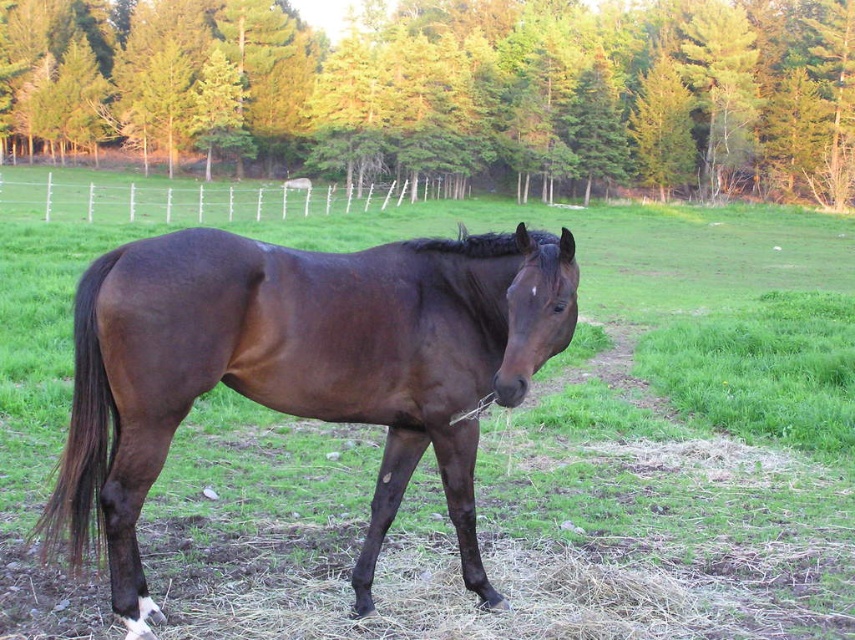
Is green leafy trees at upper center wider than shiny brown horse at center?

Correct, the width of green leafy trees at upper center exceeds that of shiny brown horse at center.

Does point (55, 45) come in front of point (376, 362)?

No, (55, 45) is further to viewer.

I want to click on green leafy trees at upper center, so click(447, 92).